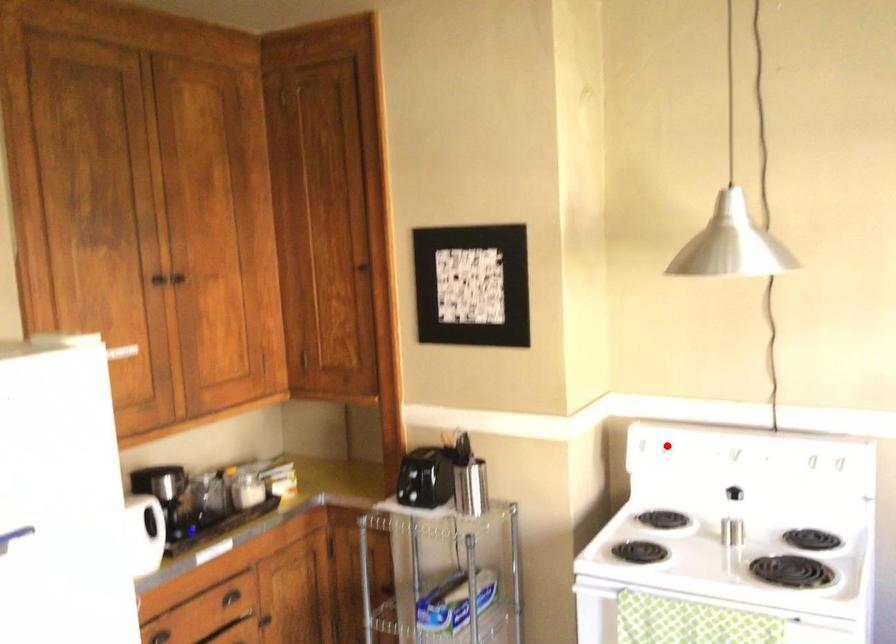
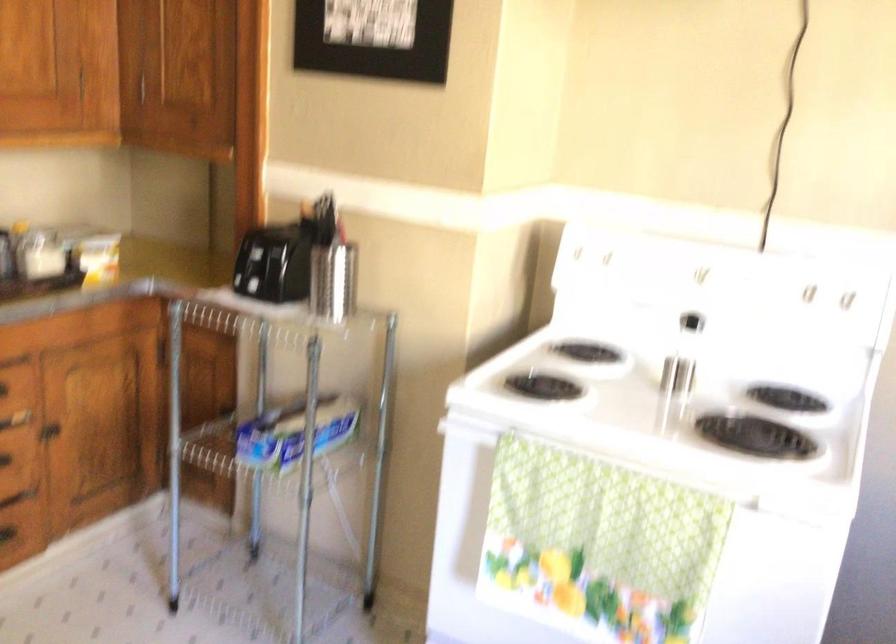
Find the pixel in the second image that matches the highlighted location in the first image.

(609, 257)